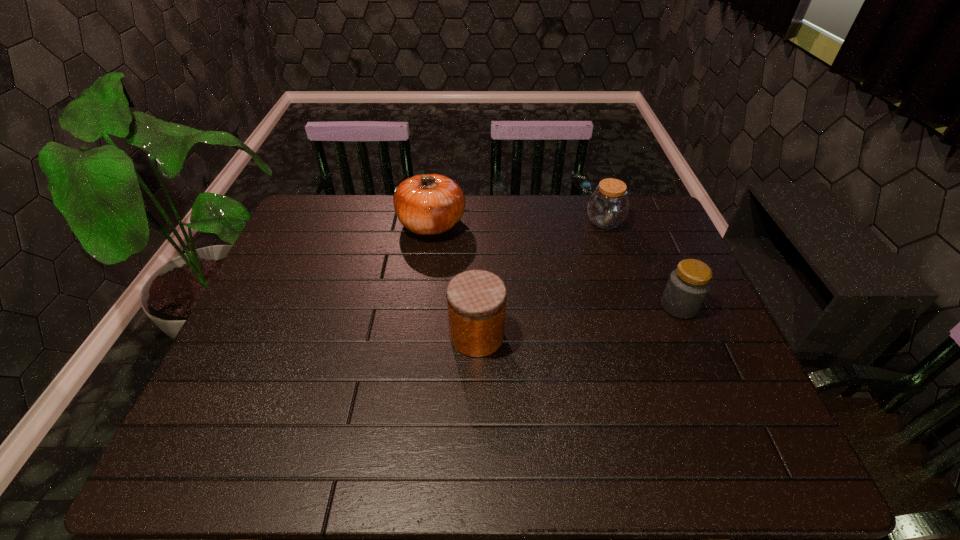
Locate which object ranks in proximity to the pumpkin. Please provide its 2D coordinates. Your answer should be formatted as a tuple, i.e. [(x, y)], where the tuple contains the x and y coordinates of a point satisfying the conditions above.

[(476, 299)]

Identify the location of jar that is the closest one to the rightmost object. This screenshot has height=540, width=960. (607, 207).

Select which jar appears as the second closest to the leftmost jar. Please provide its 2D coordinates. Your answer should be formatted as a tuple, i.e. [(x, y)], where the tuple contains the x and y coordinates of a point satisfying the conditions above.

[(607, 207)]